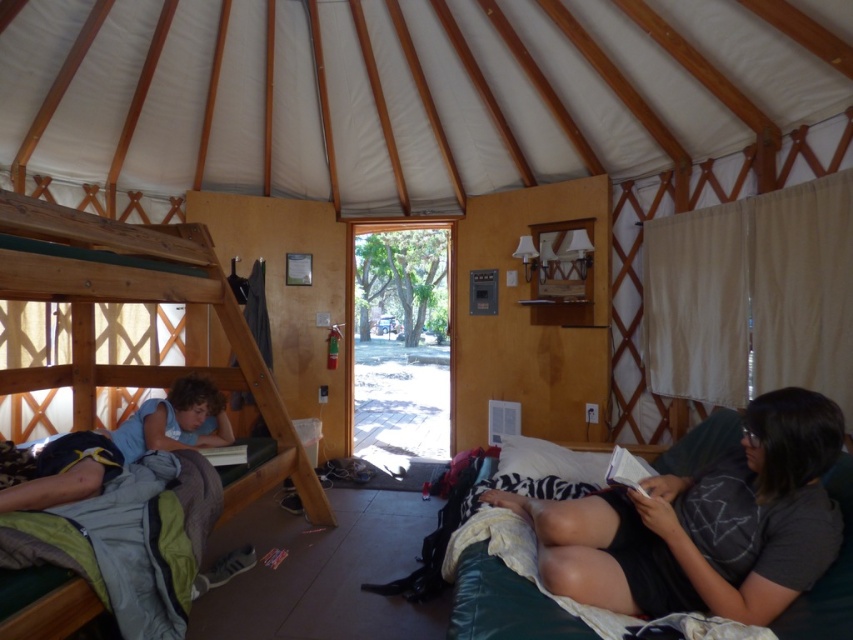
Who is positioned more to the right, white fabric canopy at upper center or wooden bunk bed at left?

From the viewer's perspective, white fabric canopy at upper center appears more on the right side.

Does point (704, 148) lie in front of point (61, 636)?

No, it is not.

Between point (166, 108) and point (137, 291), which one is positioned behind?

The point (166, 108) is behind.

The image size is (853, 640). Find the location of `white fabric canopy at upper center`. white fabric canopy at upper center is located at coordinates (405, 96).

Is white fabric canopy at upper center in front of dark gray cotton shirt at lower right?

That is False.

Does white fabric canopy at upper center have a lesser width compared to dark gray cotton shirt at lower right?

No.

Describe the element at coordinates (405, 96) in the screenshot. I see `white fabric canopy at upper center` at that location.

This screenshot has width=853, height=640. I want to click on white fabric canopy at upper center, so click(x=405, y=96).

Which of these two, dark gray cotton shirt at lower right or wooden bunk bed at left, stands taller?

Standing taller between the two is wooden bunk bed at left.

Find the location of a particular element. This screenshot has height=640, width=853. dark gray cotton shirt at lower right is located at coordinates 704,524.

Between point (619, 522) and point (106, 241), which one is positioned behind?

The point (106, 241) is behind.

The width and height of the screenshot is (853, 640). Identify the location of dark gray cotton shirt at lower right. (704, 524).